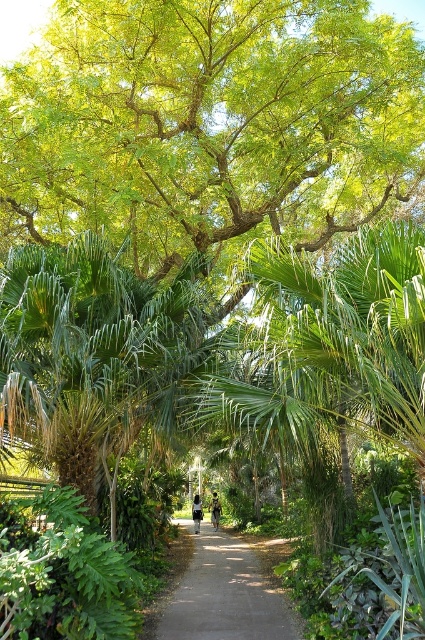
You are a hiker planning to take a photo of the green leafy tree at upper center and the green leafy palm tree at center from the path. Which tree should you stand closer to in order to capture both in a single frame?

You should stand closer to the green leafy palm tree at center because the green leafy tree at upper center is smaller in size, so positioning yourself nearer to the larger palm tree will help include both trees within the camera frame more effectively.

You are standing on the pathway and want to walk towards the point labeled point (150, 19). Which direction should you turn to face the point labeled point (48, 428)?

Since point (150, 19) is further to the camera than point (48, 428), you should turn towards the direction where point (48, 428) is closer. However, the exact direction depends on your current orientation. Without additional spatial information, it is not possible to determine the precise direction to turn.